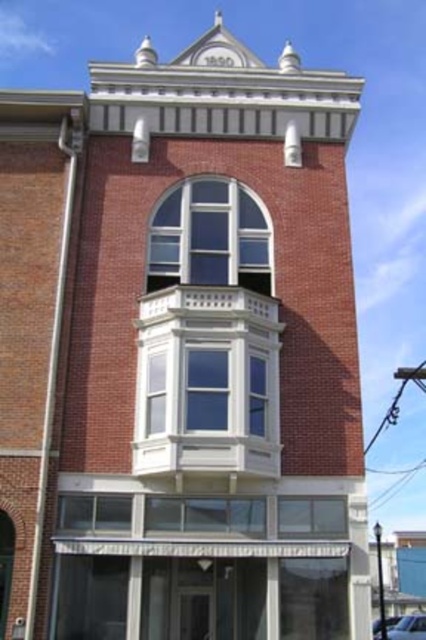
Question: Does clear glass window at center have a lesser width compared to clear glass window at lower center?

Choices:
 (A) yes
 (B) no

Answer: (B)

Question: Is clear glass window at center further to camera compared to clear glass window at lower center?

Choices:
 (A) yes
 (B) no

Answer: (A)

Question: Does clear glass window at center appear on the left side of clear glass window at lower center?

Choices:
 (A) no
 (B) yes

Answer: (B)